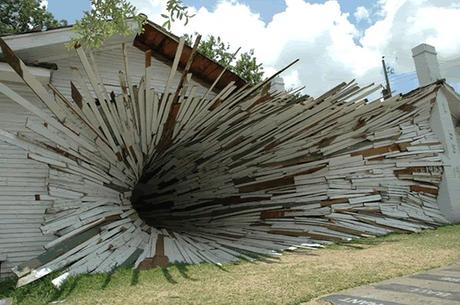
The width and height of the screenshot is (460, 305). What are the coordinates of `wall` in the screenshot? It's located at (19, 194).